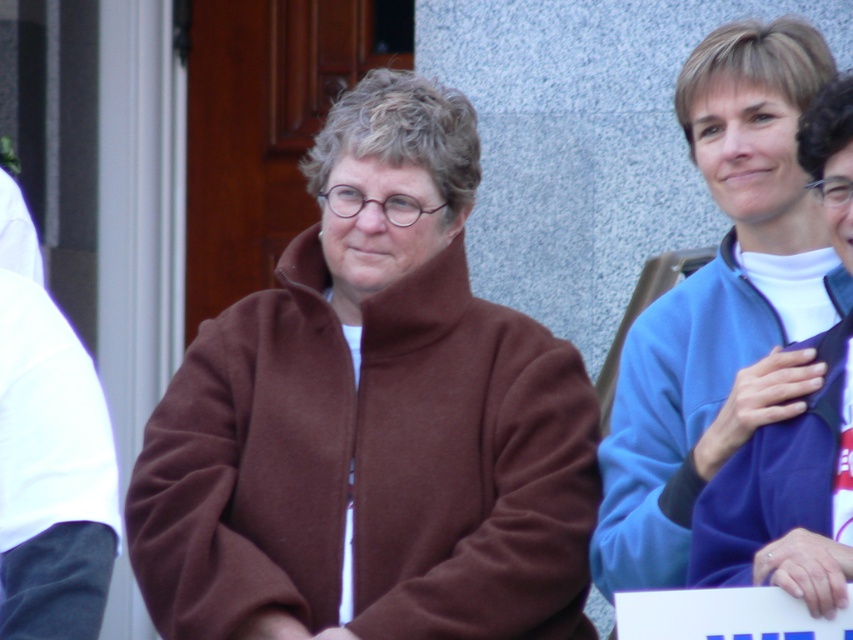
You are planning to buy a jacket similar to the ones in the image. The brown fleece jacket at center and the blue fleece jacket at right are both options. If you prefer a larger jacket, which one should you choose?

The brown fleece jacket at center is larger in size than the blue fleece jacket at right, so you should choose the brown fleece jacket at center.

You are a photographer at the event and want to capture both the brown fleece jacket at center and the blue fleece jacket at right in a single photo. Based on their positions, which jacket should you focus on first to ensure both are in frame?

The brown fleece jacket at center is located below the blue fleece jacket at right, so you should focus on the blue fleece jacket at right first to ensure both are in frame.

You are standing in front of the scene and want to touch both points. Which point should you reach for first, point [807,230] or point [9,528]?

Point [9,528] is closer to you than point [807,230], so you should reach for point [9,528] first.